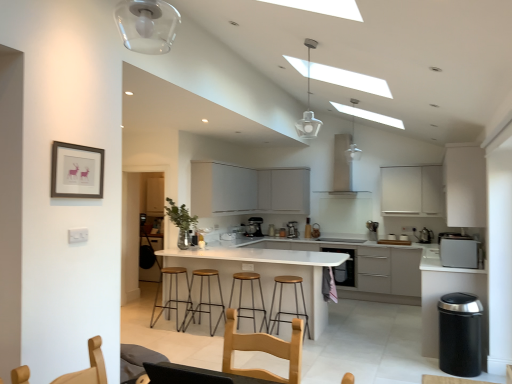
Question: Does satin silver kettle at right, the 1th appliance viewed from the front, have a lesser height compared to brown leather bar stool at center, arranged as the 1th bar stool when viewed from the left?

Choices:
 (A) no
 (B) yes

Answer: (B)

Question: Is satin silver kettle at right, which ranks as the 3th appliance in back-to-front order, positioned far away from brown leather bar stool at center, the 4th bar stool from the right?

Choices:
 (A) yes
 (B) no

Answer: (A)

Question: Does satin silver kettle at right, marked as the 3th appliance in a left-to-right arrangement, have a larger size compared to brown leather bar stool at center, the 4th bar stool from the right?

Choices:
 (A) yes
 (B) no

Answer: (B)

Question: From the image's perspective, is satin silver kettle at right, marked as the 3th appliance in a left-to-right arrangement, beneath brown leather bar stool at center, arranged as the 1th bar stool when viewed from the left?

Choices:
 (A) no
 (B) yes

Answer: (A)

Question: Does satin silver kettle at right, the 1th appliance in the right-to-left sequence, have a lesser width compared to brown leather bar stool at center, arranged as the 1th bar stool when viewed from the left?

Choices:
 (A) no
 (B) yes

Answer: (B)

Question: Is satin silver kettle at right, the 1th appliance viewed from the front, positioned behind brown leather bar stool at center, arranged as the 1th bar stool when viewed from the left?

Choices:
 (A) yes
 (B) no

Answer: (A)

Question: Is light wood swivel chair at center, the second swivel chair in the left-to-right sequence, outside green glass vase at center?

Choices:
 (A) yes
 (B) no

Answer: (A)

Question: Is light wood swivel chair at center, the second swivel chair in the left-to-right sequence, far away from green glass vase at center?

Choices:
 (A) no
 (B) yes

Answer: (B)

Question: From a real-world perspective, is light wood swivel chair at center, which is the 1th swivel chair from right to left, positioned over green glass vase at center based on gravity?

Choices:
 (A) no
 (B) yes

Answer: (A)

Question: Is light wood swivel chair at center, the second swivel chair in the left-to-right sequence, behind green glass vase at center?

Choices:
 (A) yes
 (B) no

Answer: (B)

Question: From the image's perspective, would you say light wood swivel chair at center, which is the 1th swivel chair from right to left, is positioned over green glass vase at center?

Choices:
 (A) yes
 (B) no

Answer: (B)

Question: Can you confirm if light wood swivel chair at center, which is the 1th swivel chair from right to left, is shorter than green glass vase at center?

Choices:
 (A) yes
 (B) no

Answer: (A)

Question: Does satin silver microwave at right turn towards brown leather bar stool at center, the 4th bar stool from the right?

Choices:
 (A) yes
 (B) no

Answer: (A)